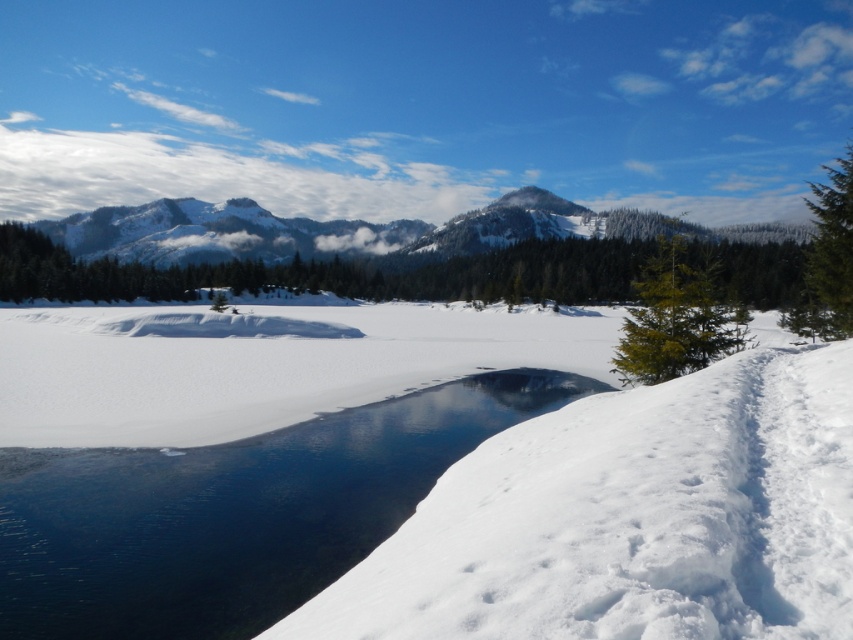
Question: Based on their relative distances, which object is nearer to the clear ice river at lower left?

Choices:
 (A) green matte tree at right
 (B) green matte tree at center
 (C) green textured pine at right

Answer: (A)

Question: Is green matte tree at center wider than green textured pine at right?

Choices:
 (A) no
 (B) yes

Answer: (A)

Question: Considering the relative positions of white fluffy snow at lower left and clear ice river at lower left in the image provided, where is white fluffy snow at lower left located with respect to clear ice river at lower left?

Choices:
 (A) below
 (B) above

Answer: (B)

Question: Is white fluffy snow at lower left closer to the viewer compared to clear ice river at lower left?

Choices:
 (A) yes
 (B) no

Answer: (A)

Question: Which object is the closest to the green textured pine at right?

Choices:
 (A) green matte tree at center
 (B) green matte tree at right
 (C) clear ice river at lower left

Answer: (C)

Question: Which is farther from the white fluffy snow at lower left?

Choices:
 (A) green textured pine at right
 (B) green matte tree at center
 (C) clear ice river at lower left

Answer: (B)